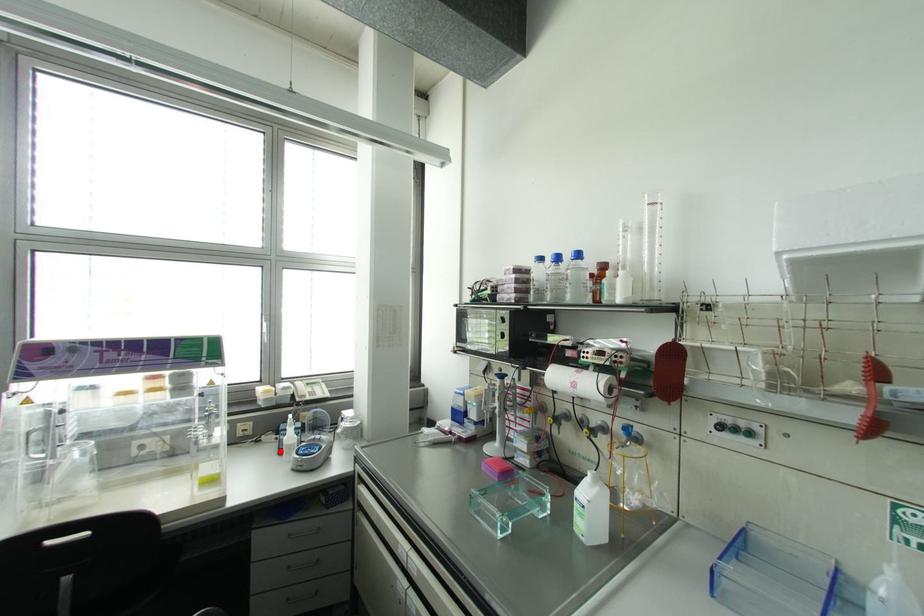
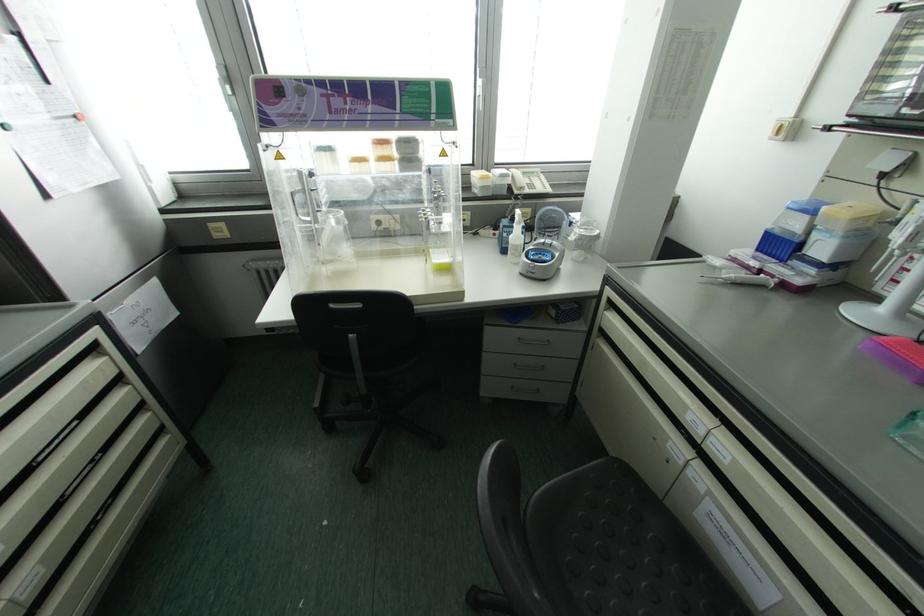
The point at the highlighted location is marked in the first image. Where is the corresponding point in the second image?

(504, 251)